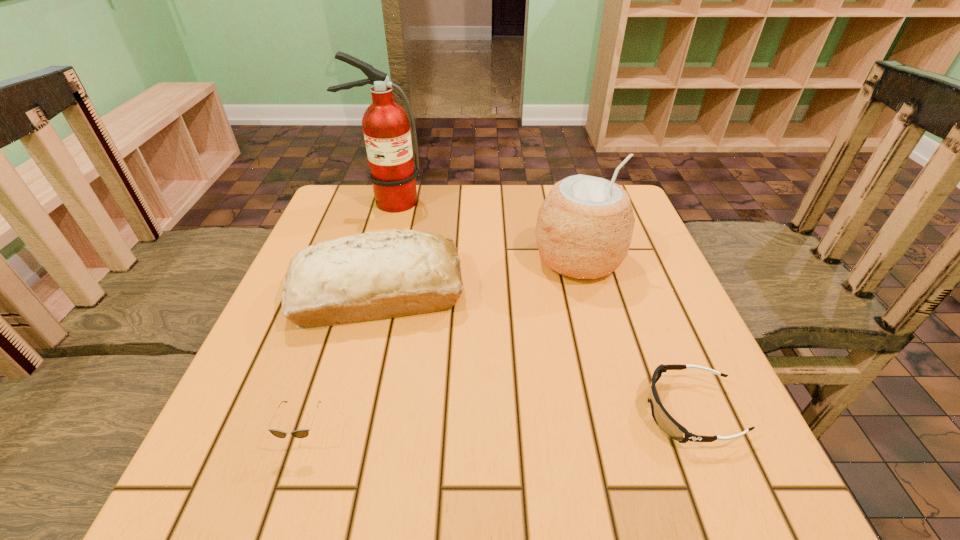
The height and width of the screenshot is (540, 960). Find the location of `free space located on the front and sides of the goggles`. free space located on the front and sides of the goggles is located at coordinates (609, 411).

Find the location of a particular element. vacant region located on the front and sides of the goggles is located at coordinates (492, 411).

Locate an element on the screen. Image resolution: width=960 pixels, height=540 pixels. vacant space located 0.080m on the front and sides of the goggles is located at coordinates (597, 411).

You are a GUI agent. You are given a task and a screenshot of the screen. Output one action in this format:
    pyautogui.click(x=<x>, y=<y>)
    Task: Click on the object that is at the far edge
    The width and height of the screenshot is (960, 540).
    Given the screenshot: What is the action you would take?
    (386, 126)

Locate an element on the screen. sunglasses present at the near edge is located at coordinates (302, 433).

I want to click on goggles at the near edge, so click(x=663, y=419).

This screenshot has height=540, width=960. Identify the location of fire extinguisher at the left edge. (386, 126).

Find the location of a particular element. The image size is (960, 540). bread at the left edge is located at coordinates (375, 275).

Locate an element on the screen. This screenshot has width=960, height=540. sunglasses that is at the left edge is located at coordinates (302, 433).

I want to click on coconut that is at the right edge, so click(x=584, y=228).